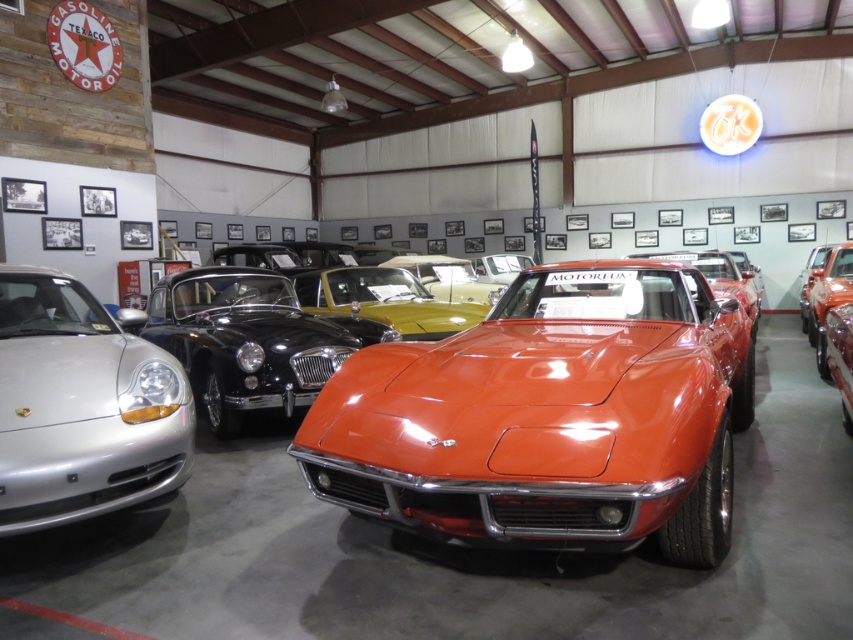
Question: Does glossy orange car at center appear under glossy orange sports car at center?

Choices:
 (A) no
 (B) yes

Answer: (A)

Question: Which of the following is the farthest from the observer?

Choices:
 (A) glossy orange sports car at center
 (B) satin silver porsche at left
 (C) glossy orange car at center

Answer: (B)

Question: Which point is closer to the camera?

Choices:
 (A) glossy orange sports car at center
 (B) glossy orange car at center
 (C) satin silver porsche at left

Answer: (B)

Question: Is glossy orange car at center above satin silver porsche at left?

Choices:
 (A) no
 (B) yes

Answer: (B)

Question: Among these objects, which one is farthest from the camera?

Choices:
 (A) glossy orange sports car at center
 (B) satin silver porsche at left
 (C) glossy orange car at center

Answer: (B)

Question: Observing the image, what is the correct spatial positioning of glossy orange car at center in reference to glossy orange sports car at center?

Choices:
 (A) below
 (B) above

Answer: (B)